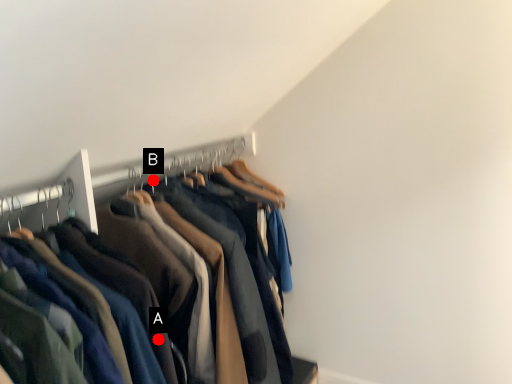
Question: Two points are circled on the image, labeled by A and B beside each circle. Which point appears farthest from the camera in this image?

Choices:
 (A) A is further
 (B) B is further

Answer: (B)